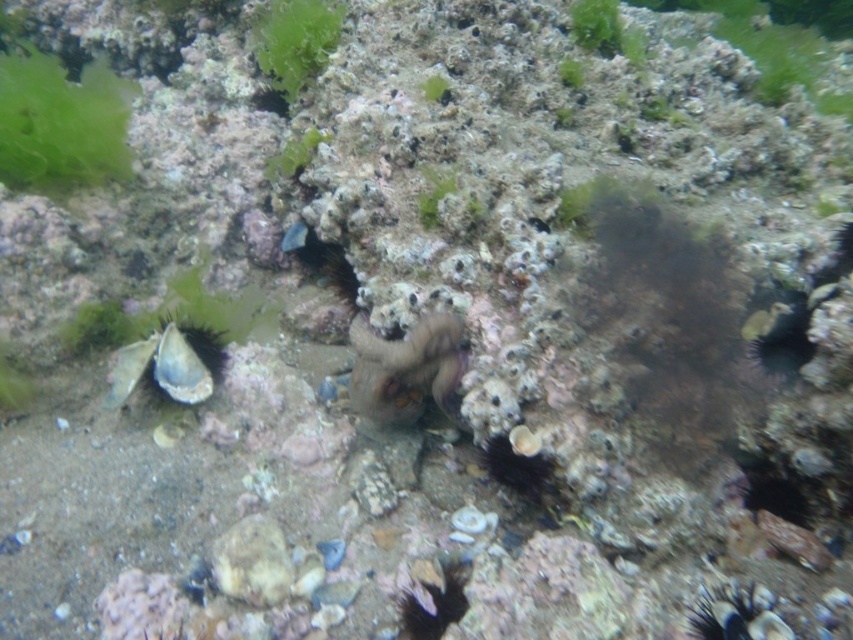
You are a marine biologist studying underwater organisms. You observe the blue spiky shell at lower left and the green matte algae at upper center. Which object is wider?

The green matte algae at upper center is wider than the blue spiky shell at lower left.

You are a marine biologist examining the underwater scene. You need to determine the visibility of the purple rubber octopus at center and the blue spiky shell at lower left. Which object is closer to the camera?

The purple rubber octopus at center is in front of the blue spiky shell at lower left, so it is closer to the camera.

You are a marine biologist studying underwater plants. You observe the green leafy algae at upper left and the green matte algae at upper center in the scene. Which of these two algae is taller?

The green leafy algae at upper left is much taller than the green matte algae at upper center.